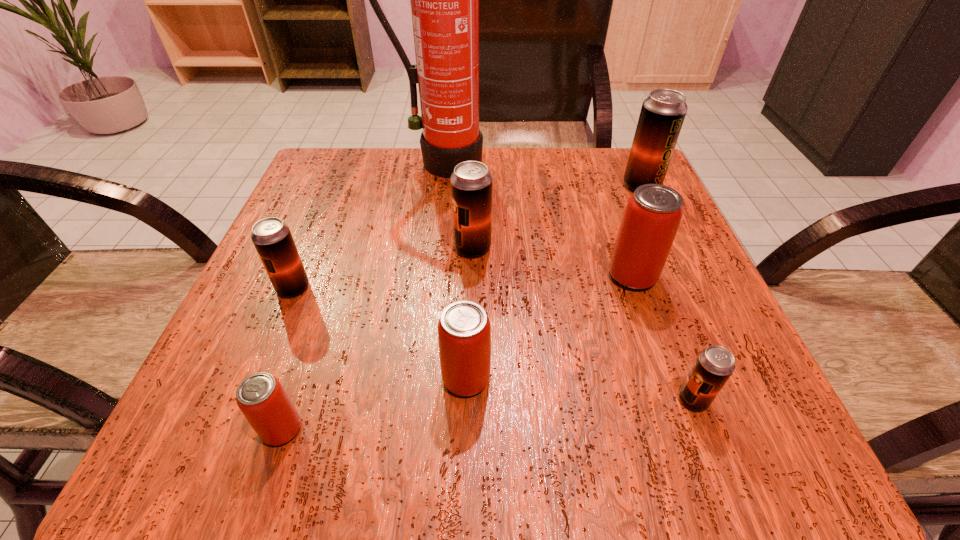
This screenshot has width=960, height=540. What are the coordinates of `free area in between the third black beer can from right to left and the leftmost black beer can` in the screenshot? It's located at (383, 268).

Identify which object is located as the seventh nearest to the leftmost object. Please provide its 2D coordinates. Your answer should be formatted as a tuple, i.e. [(x, y)], where the tuple contains the x and y coordinates of a point satisfying the conditions above.

[(663, 112)]

Identify which object is located as the nearest to the second tallest object. Please provide its 2D coordinates. Your answer should be formatted as a tuple, i.e. [(x, y)], where the tuple contains the x and y coordinates of a point satisfying the conditions above.

[(653, 213)]

You are a GUI agent. You are given a task and a screenshot of the screen. Output one action in this format:
    pyautogui.click(x=<x>, y=<y>)
    Task: Click on the beer can that is the fifth closest to the leftmost black beer can
    The width and height of the screenshot is (960, 540).
    Given the screenshot: What is the action you would take?
    pyautogui.click(x=714, y=365)

Locate an element on the screen. The width and height of the screenshot is (960, 540). beer can that is the sixth closest to the biggest pink beer can is located at coordinates (272, 238).

Identify which black beer can is located as the third nearest to the leftmost black beer can. Please provide its 2D coordinates. Your answer should be formatted as a tuple, i.e. [(x, y)], where the tuple contains the x and y coordinates of a point satisfying the conditions above.

[(663, 112)]

I want to click on the second closest black beer can relative to the tallest object, so click(x=663, y=112).

Choose which pink beer can is the third nearest neighbor to the tallest object. Please provide its 2D coordinates. Your answer should be formatted as a tuple, i.e. [(x, y)], where the tuple contains the x and y coordinates of a point satisfying the conditions above.

[(262, 399)]

The height and width of the screenshot is (540, 960). Find the location of `the closest pink beer can to the third black beer can from left to right`. the closest pink beer can to the third black beer can from left to right is located at coordinates (653, 213).

Where is `free space that satisfies the following two spatial constraints: 1. on the back side of the second object from left to right; 2. on the left side of the biggest pink beer can`? free space that satisfies the following two spatial constraints: 1. on the back side of the second object from left to right; 2. on the left side of the biggest pink beer can is located at coordinates (x=333, y=276).